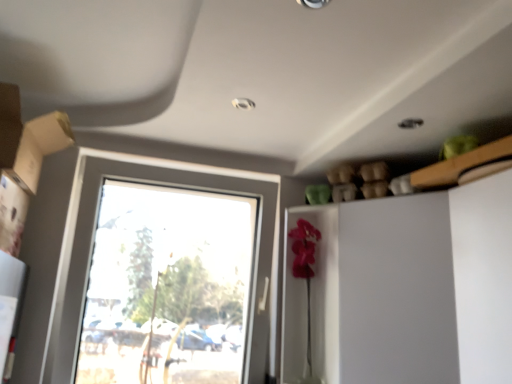
Question: Based on their sizes in the image, would you say white glossy dresser at right is bigger or smaller than matte cardboard box at left?

Choices:
 (A) small
 (B) big

Answer: (B)

Question: Considering the positions of point (282, 329) and point (34, 172), is point (282, 329) closer or farther from the camera than point (34, 172)?

Choices:
 (A) farther
 (B) closer

Answer: (A)

Question: Estimate the real-world distances between objects in this image. Which object is farther from the matte cardboard box at left?

Choices:
 (A) white glossy dresser at right
 (B) clear glass window at center

Answer: (A)

Question: Based on their relative distances, which object is nearer to the white glossy dresser at right?

Choices:
 (A) clear glass window at center
 (B) matte cardboard box at left

Answer: (A)